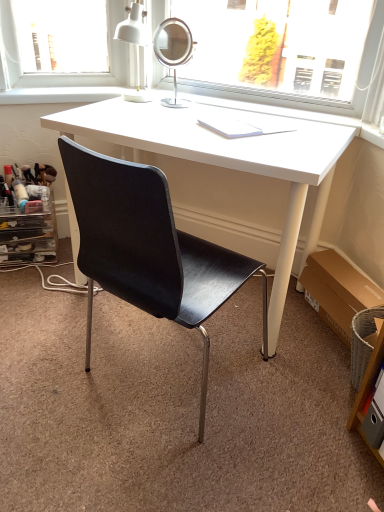
Find the location of a particular element. Image resolution: width=384 pixels, height=512 pixels. free point in front of clear plastic drawer at lower left, placed as the second shelf when sorted from right to left is located at coordinates (31, 286).